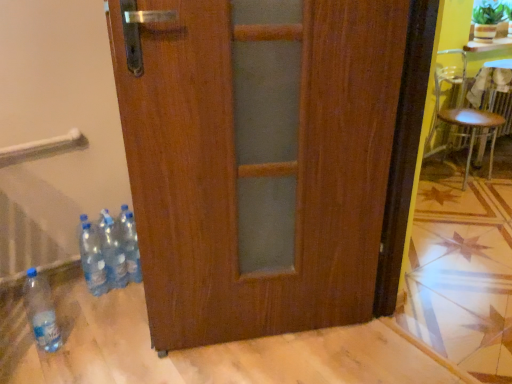
Identify the location of free point to the left of transparent plastic bottle at lower left, which is the 1th bottle from left to right. pyautogui.click(x=16, y=342).